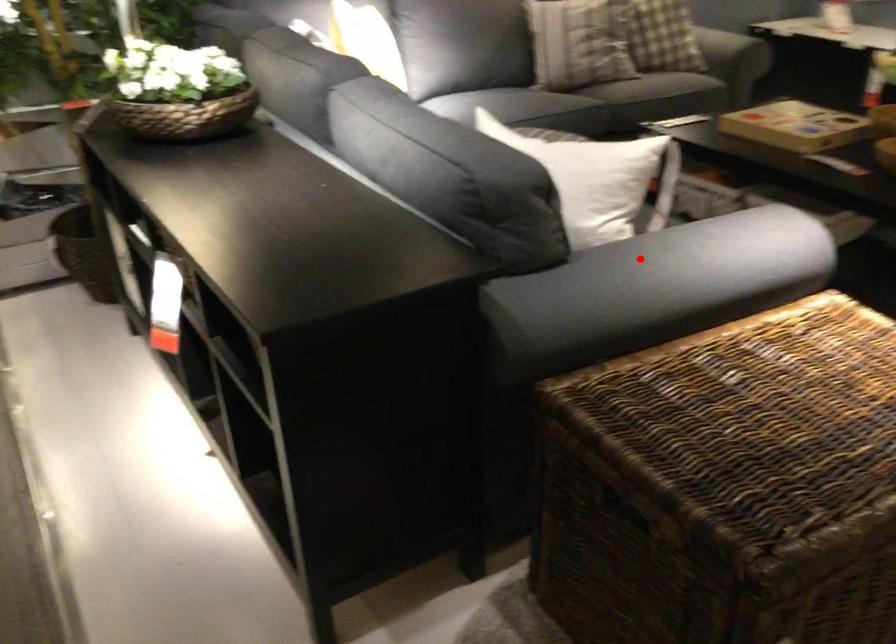
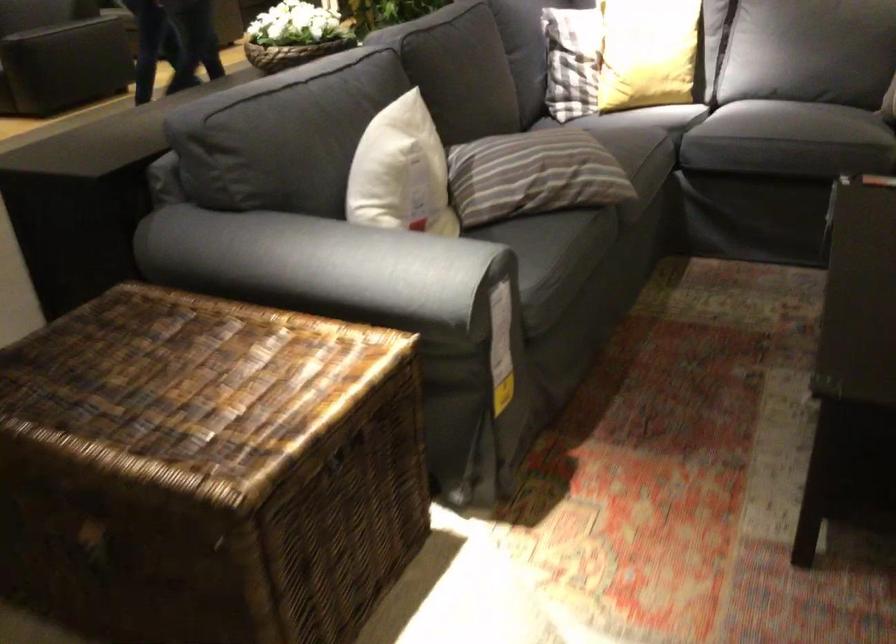
Question: I am providing you with two images of the same scene from different viewpoints. A red point is marked on the first image. Can you still see the location of the red point in image 2?

Choices:
 (A) Yes
 (B) No

Answer: (A)